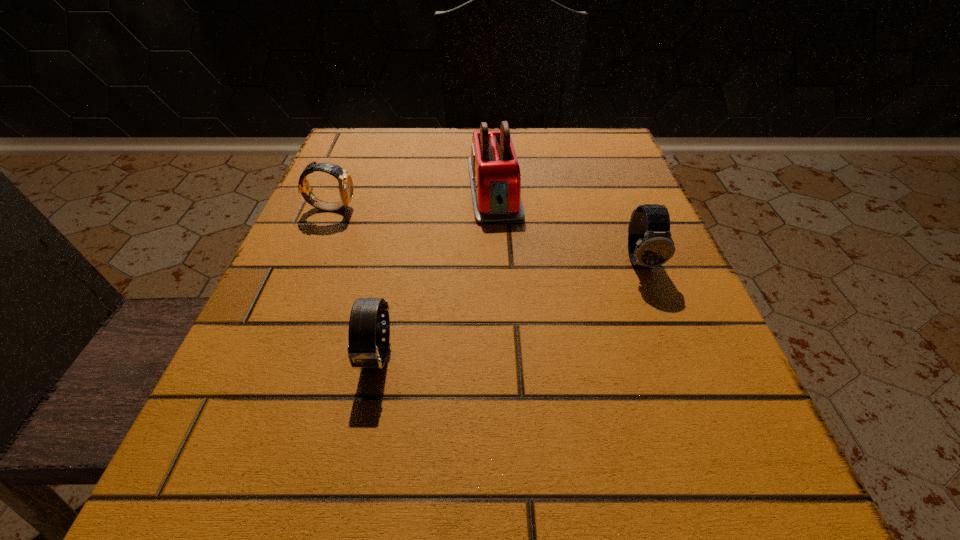
Where is `free point between the leftmost watch and the second nearest object`? free point between the leftmost watch and the second nearest object is located at coordinates (486, 234).

You are a GUI agent. You are given a task and a screenshot of the screen. Output one action in this format:
    pyautogui.click(x=<x>, y=<y>)
    Task: Click on the free point between the second nearest watch and the farthest watch
    
    Given the screenshot: What is the action you would take?
    pyautogui.click(x=486, y=234)

Identify the location of free space between the tallest object and the leftmost watch. (413, 198).

Identify the location of free space that is in between the tallest object and the nearest object. This screenshot has width=960, height=540. (436, 272).

Find the location of a particular element. vacant area that lies between the second farthest watch and the nearest object is located at coordinates (509, 308).

This screenshot has height=540, width=960. What are the coordinates of `vacant area that lies between the toaster and the farthest watch` in the screenshot? It's located at (413, 198).

The height and width of the screenshot is (540, 960). Identify the location of free spot between the tallest object and the farthest watch. (413, 198).

The height and width of the screenshot is (540, 960). I want to click on free space that is in between the third farthest object and the nearest object, so click(509, 308).

The height and width of the screenshot is (540, 960). Identify the location of free spot between the third farthest object and the farthest watch. (486, 234).

The height and width of the screenshot is (540, 960). What are the coordinates of `blank region between the nearest watch and the leftmost object` in the screenshot? It's located at (354, 281).